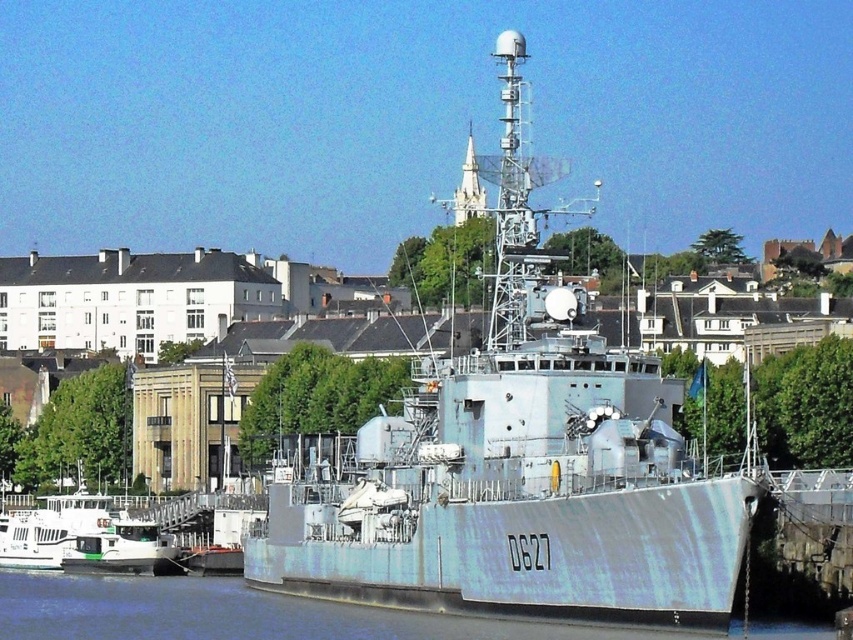
Is light blue metallic ship at center positioned in front of blue metallic water at lower center?

Yes, it is in front of blue metallic water at lower center.

Is light blue metallic ship at center above blue metallic water at lower center?

Correct, light blue metallic ship at center is located above blue metallic water at lower center.

Is point (405, 408) farther from viewer compared to point (268, 593)?

No, it is not.

At what (x,y) coordinates should I click in order to perform the action: click on light blue metallic ship at center. Please return your answer as a coordinate pair (x, y). The height and width of the screenshot is (640, 853). Looking at the image, I should click on (519, 465).